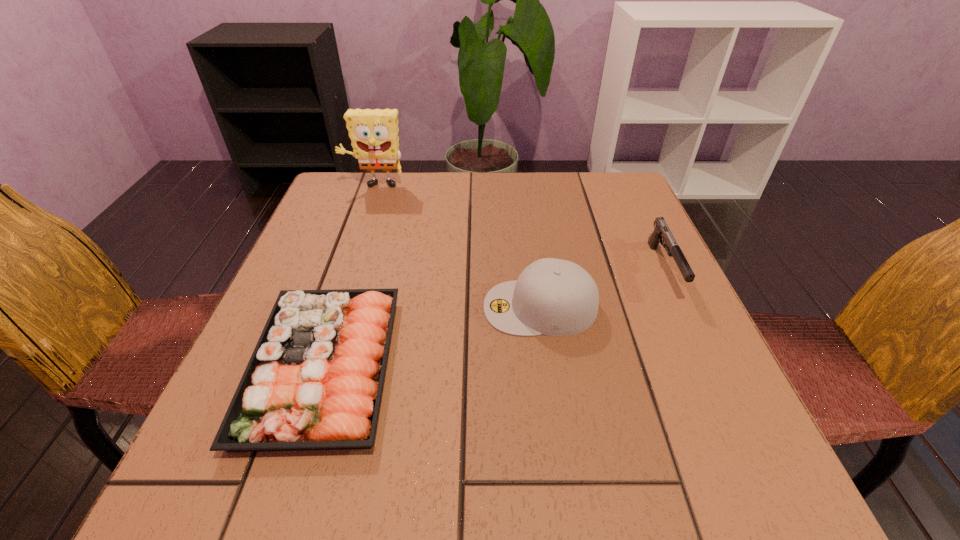
The image size is (960, 540). I want to click on free point between the gun and the second object from right to left, so click(602, 288).

Where is `free space between the third object from left to right and the gun`? The image size is (960, 540). free space between the third object from left to right and the gun is located at coordinates (602, 288).

Identify the location of blank region between the third object from left to right and the shortest object. The height and width of the screenshot is (540, 960). (432, 337).

The width and height of the screenshot is (960, 540). Identify the location of free space between the tallest object and the rightmost object. (519, 228).

The image size is (960, 540). What are the coordinates of `unoccupied position between the platter and the third object from left to right` in the screenshot? It's located at click(x=432, y=337).

The height and width of the screenshot is (540, 960). Find the location of `vacant area that lies between the rightmost object and the cap`. vacant area that lies between the rightmost object and the cap is located at coordinates (602, 288).

Image resolution: width=960 pixels, height=540 pixels. I want to click on the second closest object to the farthest object, so click(555, 297).

Locate which object is the second closest to the farthest object. Please provide its 2D coordinates. Your answer should be formatted as a tuple, i.e. [(x, y)], where the tuple contains the x and y coordinates of a point satisfying the conditions above.

[(555, 297)]

You are a GUI agent. You are given a task and a screenshot of the screen. Output one action in this format:
    pyautogui.click(x=<x>, y=<y>)
    Task: Click on the vacant space that satisfies the following two spatial constraints: 1. on the face of the shortest object; 2. on the left side of the sponge
    
    Given the screenshot: What is the action you would take?
    pyautogui.click(x=314, y=367)

I want to click on vacant point that satisfies the following two spatial constraints: 1. at the muzzle end of the third tallest object; 2. on the front-facing side of the cap, so click(682, 307).